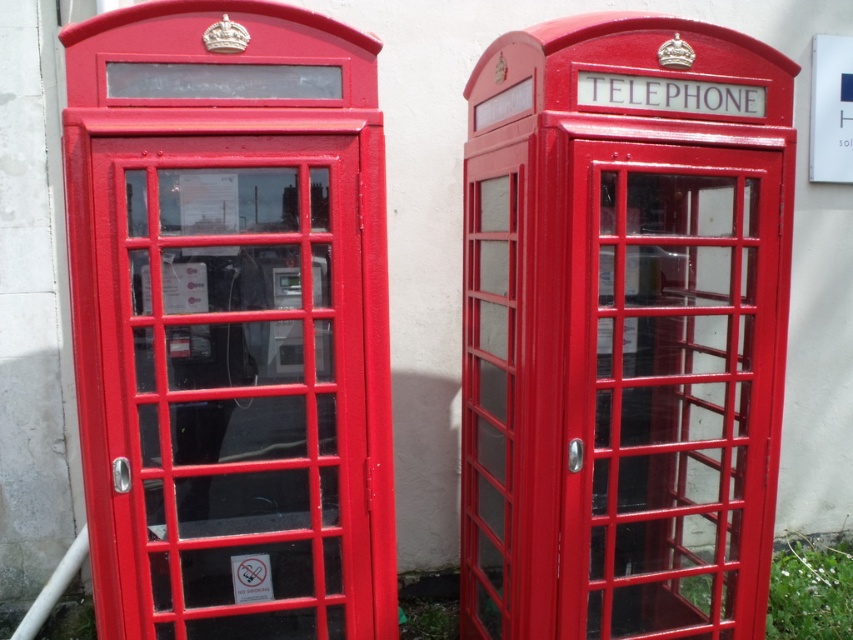
You are a painter who wants to paint both the glossy red telephone booth at center and the metallic red telephone box at left. Since you need to paint them in order from tallest to shortest, which one should you start with?

The glossy red telephone booth at center is taller than the metallic red telephone box at left, so you should start painting the glossy red telephone booth at center first.

Consider the image. You are a painter standing in front of the two telephone booths. You want to paint the booth that is closer to you. Which one should you choose between the glossy red telephone booth at center and the metallic red telephone box at left?

→ The glossy red telephone booth at center is closer to the viewer than the metallic red telephone box at left, so you should choose the glossy red telephone booth at center to paint.

You are standing in front of two red telephone booths. The glossy red telephone booth at center and the metallic red telephone box at left. Which one is positioned lower in the image?

The glossy red telephone booth at center is positioned lower than the metallic red telephone box at left.